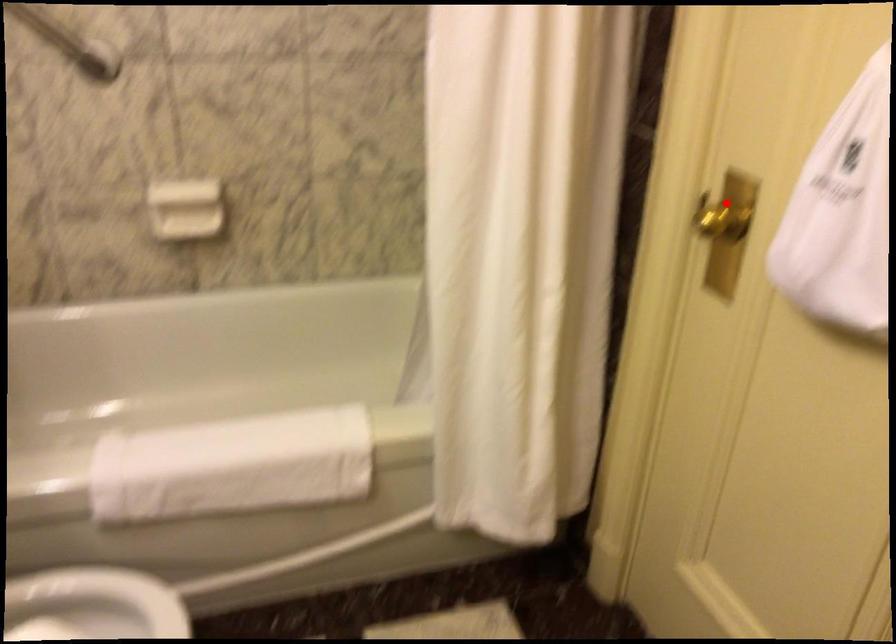
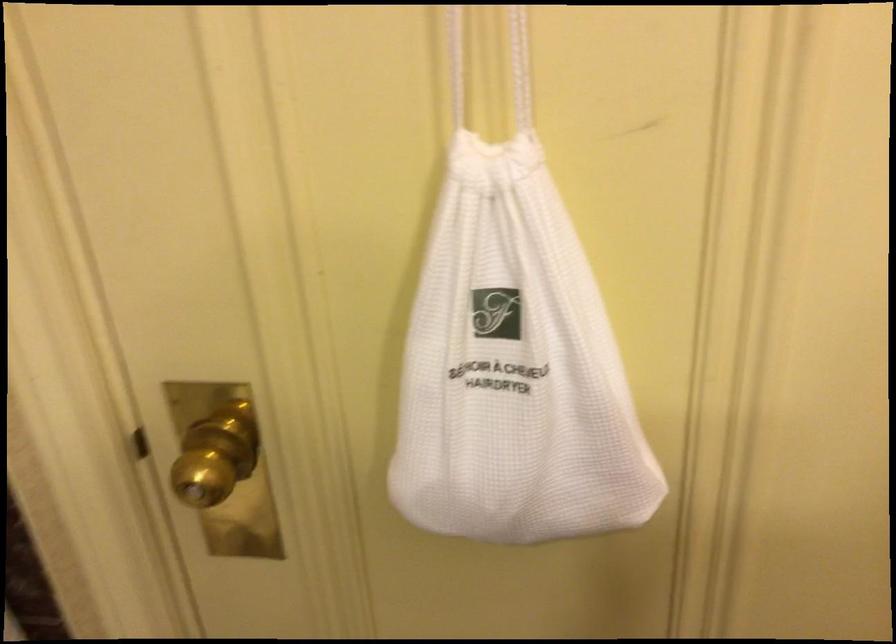
Locate, in the second image, the point that corresponds to the highlighted location in the first image.

(216, 456)